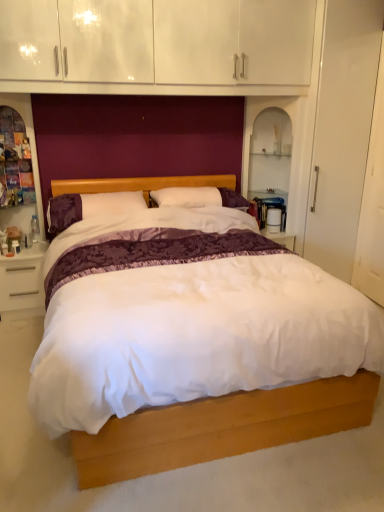
Question: From a real-world perspective, is purple velvet pillow at center on top of white glossy nightstand at lower left?

Choices:
 (A) no
 (B) yes

Answer: (B)

Question: Can you confirm if purple velvet pillow at center is positioned to the left of white glossy nightstand at lower left?

Choices:
 (A) no
 (B) yes

Answer: (A)

Question: Is purple velvet pillow at center shorter than white glossy nightstand at lower left?

Choices:
 (A) no
 (B) yes

Answer: (B)

Question: Considering the relative sizes of purple velvet pillow at center and white glossy nightstand at lower left in the image provided, is purple velvet pillow at center thinner than white glossy nightstand at lower left?

Choices:
 (A) no
 (B) yes

Answer: (A)

Question: Is purple velvet pillow at center positioned before white glossy nightstand at lower left?

Choices:
 (A) no
 (B) yes

Answer: (B)

Question: Relative to wooden dresser at left, is purple velvet pillow at center in front or behind?

Choices:
 (A) behind
 (B) front

Answer: (A)

Question: Visually, is purple velvet pillow at center positioned to the left or to the right of wooden dresser at left?

Choices:
 (A) left
 (B) right

Answer: (B)

Question: From their relative heights in the image, would you say purple velvet pillow at center is taller or shorter than wooden dresser at left?

Choices:
 (A) tall
 (B) short

Answer: (B)

Question: From the image's perspective, relative to wooden dresser at left, is purple velvet pillow at center above or below?

Choices:
 (A) below
 (B) above

Answer: (A)

Question: From the image's perspective, is wooden dresser at left located above or below white glossy nightstand at lower left?

Choices:
 (A) above
 (B) below

Answer: (A)

Question: From their relative heights in the image, would you say wooden dresser at left is taller or shorter than white glossy nightstand at lower left?

Choices:
 (A) short
 (B) tall

Answer: (B)

Question: In terms of size, does wooden dresser at left appear bigger or smaller than white glossy nightstand at lower left?

Choices:
 (A) big
 (B) small

Answer: (A)

Question: From a real-world perspective, relative to white glossy nightstand at lower left, is wooden dresser at left vertically above or below?

Choices:
 (A) above
 (B) below

Answer: (A)

Question: Is point (13, 293) positioned closer to the camera than point (14, 99)?

Choices:
 (A) closer
 (B) farther

Answer: (A)

Question: From their relative heights in the image, would you say white glossy nightstand at lower left is taller or shorter than wooden dresser at left?

Choices:
 (A) tall
 (B) short

Answer: (B)